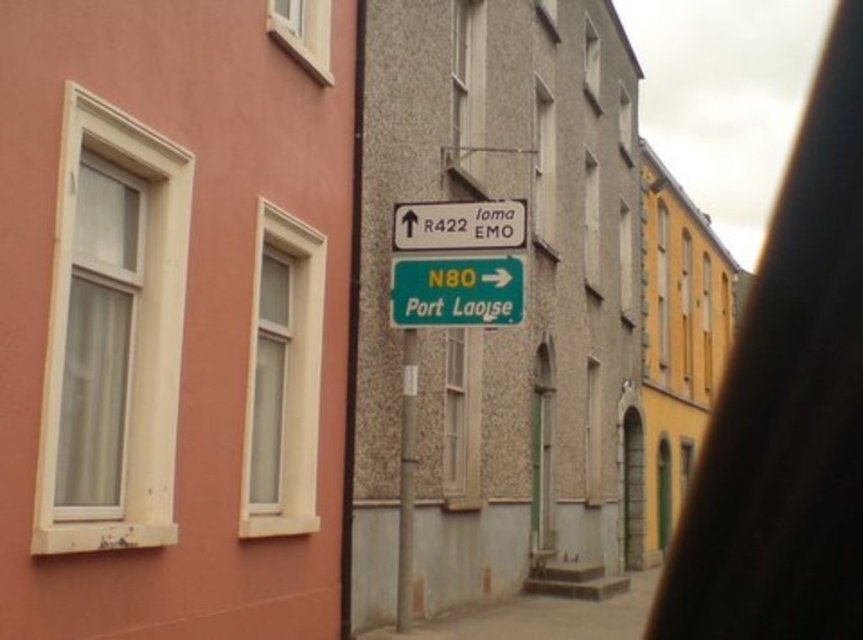
Locate an element on the screen. white plastic window at left is located at coordinates (112, 333).

Who is higher up, white plastic window at left or white plastic sign at upper center?

Positioned higher is white plastic sign at upper center.

Which is in front, point (148, 392) or point (523, 240)?

Point (148, 392) is in front.

This screenshot has width=863, height=640. Identify the location of white plastic window at left. (112, 333).

Is green matte sign at center further to camera compared to clear glass window at upper left?

Yes, it is behind clear glass window at upper left.

In the scene shown: Can you confirm if green matte sign at center is thinner than clear glass window at upper left?

No.

Locate an element on the screen. green matte sign at center is located at coordinates (457, 291).

Is gray concrete alley at center shorter than white plastic sign at upper center?

Indeed, gray concrete alley at center has a lesser height compared to white plastic sign at upper center.

Which of these two, gray concrete alley at center or white plastic sign at upper center, stands taller?

white plastic sign at upper center is taller.

This screenshot has height=640, width=863. What do you see at coordinates (545, 612) in the screenshot? I see `gray concrete alley at center` at bounding box center [545, 612].

Identify the location of gray concrete alley at center. coord(545,612).